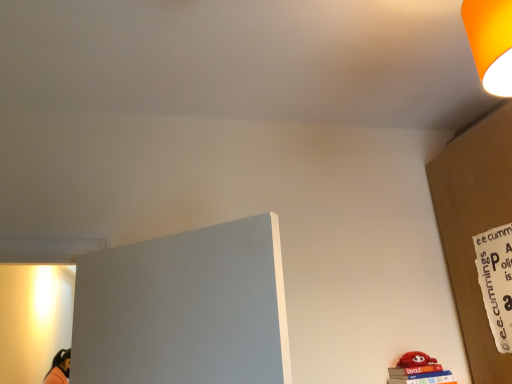
Question: Can you confirm if orange matte lampshade at upper right is taller than white paper sign at right?

Choices:
 (A) yes
 (B) no

Answer: (B)

Question: Is orange matte lampshade at upper right closer to camera compared to white paper sign at right?

Choices:
 (A) yes
 (B) no

Answer: (A)

Question: Is orange matte lampshade at upper right turned away from white paper sign at right?

Choices:
 (A) yes
 (B) no

Answer: (B)

Question: Is orange matte lampshade at upper right wider than white paper sign at right?

Choices:
 (A) yes
 (B) no

Answer: (A)

Question: From a real-world perspective, is orange matte lampshade at upper right under white paper sign at right?

Choices:
 (A) yes
 (B) no

Answer: (B)

Question: Can you confirm if orange matte lampshade at upper right is bigger than white paper sign at right?

Choices:
 (A) no
 (B) yes

Answer: (B)

Question: From a real-world perspective, is white paper sign at right beneath orange matte lampshade at upper right?

Choices:
 (A) no
 (B) yes

Answer: (B)

Question: Can you confirm if white paper sign at right is wider than orange matte lampshade at upper right?

Choices:
 (A) no
 (B) yes

Answer: (A)

Question: Can we say white paper sign at right lies outside orange matte lampshade at upper right?

Choices:
 (A) yes
 (B) no

Answer: (A)

Question: Does white paper sign at right lie in front of orange matte lampshade at upper right?

Choices:
 (A) yes
 (B) no

Answer: (B)

Question: Could you tell me if white paper sign at right is facing orange matte lampshade at upper right?

Choices:
 (A) yes
 (B) no

Answer: (B)

Question: Is white paper sign at right behind orange matte lampshade at upper right?

Choices:
 (A) no
 (B) yes

Answer: (B)

Question: From a real-world perspective, is orange matte lampshade at upper right positioned above or below white paper sign at right?

Choices:
 (A) below
 (B) above

Answer: (B)